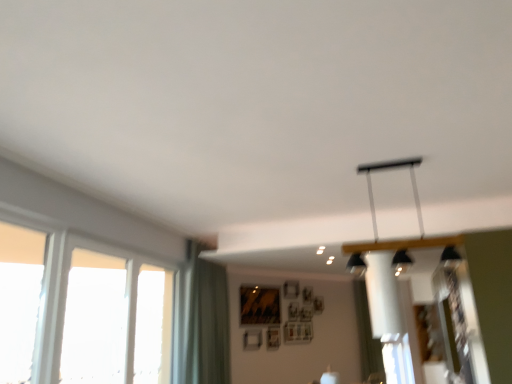
Question: From the image's perspective, is green fabric curtain at lower left, the second curtain from the back, above clear glass window at left, the 3th window viewed from the left?

Choices:
 (A) no
 (B) yes

Answer: (A)

Question: From a real-world perspective, is green fabric curtain at lower left, the first curtain viewed from the front, on top of clear glass window at left, placed as the first window when sorted from right to left?

Choices:
 (A) yes
 (B) no

Answer: (A)

Question: Is green fabric curtain at lower left, the second curtain from the back, bigger than clear glass window at left, the 3th window viewed from the left?

Choices:
 (A) yes
 (B) no

Answer: (A)

Question: Is green fabric curtain at lower left, the second curtain from the back, further to camera compared to clear glass window at left, placed as the first window when sorted from right to left?

Choices:
 (A) yes
 (B) no

Answer: (A)

Question: Could you tell me if green fabric curtain at lower left, the first curtain viewed from the front, is facing clear glass window at left, placed as the first window when sorted from right to left?

Choices:
 (A) no
 (B) yes

Answer: (A)

Question: Does green fabric curtain at lower left, the 1th curtain in the left-to-right sequence, have a greater width compared to clear glass window at left, placed as the first window when sorted from right to left?

Choices:
 (A) yes
 (B) no

Answer: (A)

Question: Can you confirm if green fabric curtain at lower left, the first curtain viewed from the front, is bigger than transparent glass window at left, which is counted as the 2th window, starting from the left?

Choices:
 (A) yes
 (B) no

Answer: (A)

Question: Can you confirm if green fabric curtain at lower left, the first curtain viewed from the front, is thinner than transparent glass window at left, which is counted as the 2th window, starting from the left?

Choices:
 (A) no
 (B) yes

Answer: (A)

Question: Can you confirm if green fabric curtain at lower left, the first curtain viewed from the front, is positioned to the right of transparent glass window at left, which is counted as the 2th window, starting from the left?

Choices:
 (A) no
 (B) yes

Answer: (B)

Question: Are green fabric curtain at lower left, the 1th curtain in the left-to-right sequence, and transparent glass window at left, which is counted as the second window, starting from the right, far apart?

Choices:
 (A) no
 (B) yes

Answer: (B)

Question: Does green fabric curtain at lower left, arranged as the 2th curtain when viewed from the right, turn towards transparent glass window at left, which is counted as the 2th window, starting from the left?

Choices:
 (A) yes
 (B) no

Answer: (B)

Question: From the image's perspective, is green fabric curtain at lower left, the 1th curtain in the left-to-right sequence, above transparent glass window at left, which is counted as the 2th window, starting from the left?

Choices:
 (A) yes
 (B) no

Answer: (B)

Question: Is transparent glass window at left, which is counted as the second window, starting from the right, oriented towards white fabric curtain at center, positioned as the second curtain in left-to-right order?

Choices:
 (A) yes
 (B) no

Answer: (B)